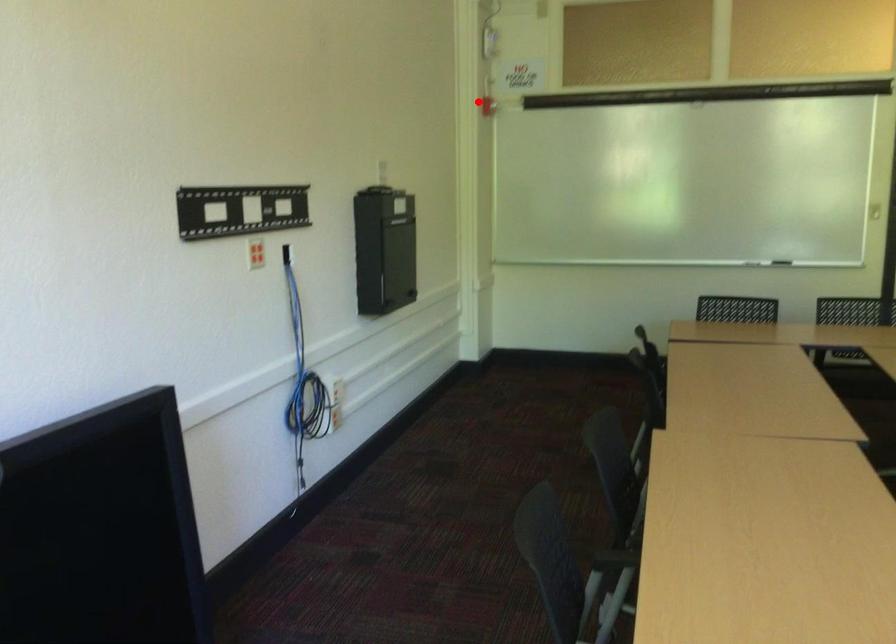
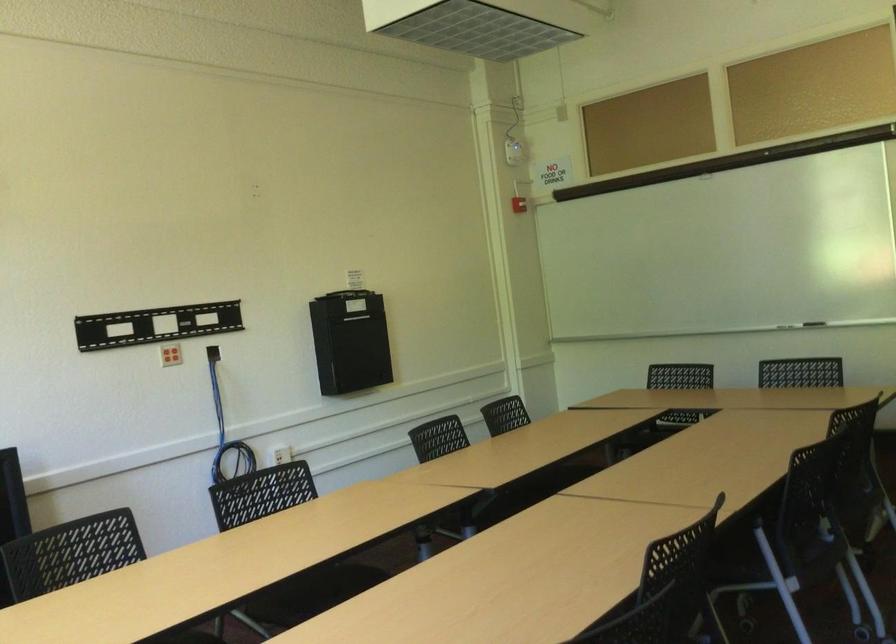
Question: A red point is marked in image1. In image2, is the corresponding 3D point closer to the camera or farther? Reply with the corresponding letter.

Choices:
 (A) The corresponding 3D point is closer.
 (B) The corresponding 3D point is farther.

Answer: (B)